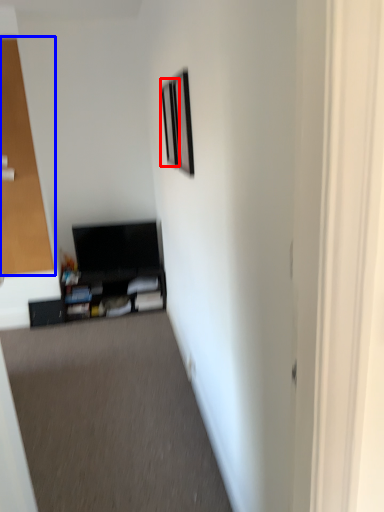
Question: Among these objects, which one is farthest to the camera, picture frame (highlighted by a red box) or glass door (highlighted by a blue box)?

Choices:
 (A) picture frame
 (B) glass door

Answer: (B)